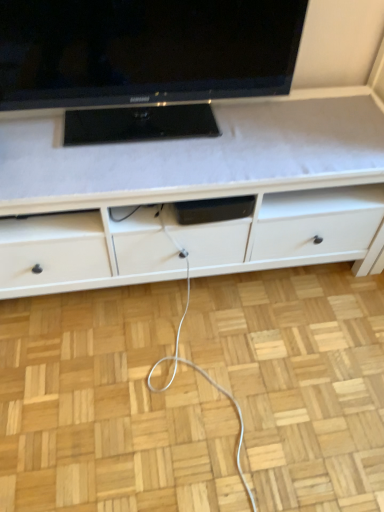
Locate an element on the screen. This screenshot has height=512, width=384. vacant space underneath black glossy tv at upper center (from a real-world perspective) is located at coordinates (151, 125).